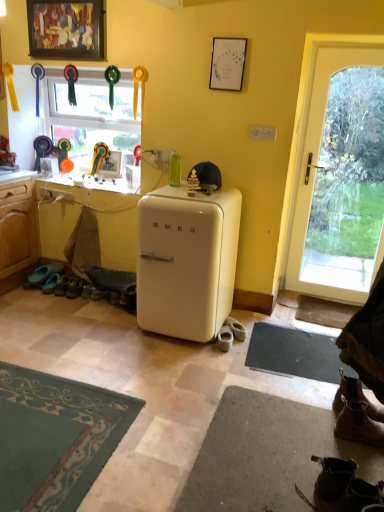
Measure the distance between point (228,348) and camera.

Point (228,348) is 9.09 feet away from camera.

Find the location of a particular element. This screenshot has width=384, height=512. black rubber yoga mat at lower right is located at coordinates (294, 353).

Image resolution: width=384 pixels, height=512 pixels. What do you see at coordinates (294, 353) in the screenshot?
I see `black rubber yoga mat at lower right` at bounding box center [294, 353].

In order to face brown leather boot at lower right, the 4th footwear from the left, should I rotate leftwards or rightwards?

To align with it, rotate right about 21.911°.

Find the location of a particular element. white suede shoes at lower center, marked as the 3th footwear in a left-to-right arrangement is located at coordinates (236, 329).

Considering the relative sizes of brown leather boot at lower right, the first footwear positioned from the right, and white glossy refrigerator at center in the image provided, is brown leather boot at lower right, the first footwear positioned from the right, smaller than white glossy refrigerator at center?

Indeed, brown leather boot at lower right, the first footwear positioned from the right, has a smaller size compared to white glossy refrigerator at center.

Where is `refrigerator located behind the brown leather boot at lower right, which is the fourth footwear in back-to-front order`? The height and width of the screenshot is (512, 384). refrigerator located behind the brown leather boot at lower right, which is the fourth footwear in back-to-front order is located at coordinates (186, 261).

From the image's perspective, would you say brown leather boot at lower right, the first footwear positioned from the right, is positioned over white glossy refrigerator at center?

No.

Is brown leather boot at lower right, the fifth footwear in the left-to-right sequence, located outside white glossy refrigerator at center?

Absolutely, brown leather boot at lower right, the fifth footwear in the left-to-right sequence, is external to white glossy refrigerator at center.

Does point (319, 343) come farther from viewer compared to point (46, 272)?

No, (319, 343) is in front of (46, 272).

Measure the distance from black rubber yoga mat at lower right to matte green shoe at lower left, placed as the 5th footwear when sorted from right to left.

The distance of black rubber yoga mat at lower right from matte green shoe at lower left, placed as the 5th footwear when sorted from right to left, is 1.95 meters.

Starting from the black rubber yoga mat at lower right, which footwear is the 3rd one to the left? Please provide its 2D coordinates.

[(42, 275)]

Is black rubber yoga mat at lower right not inside matte green shoe at lower left, placed as the 5th footwear when sorted from front to back?

black rubber yoga mat at lower right is positioned outside matte green shoe at lower left, placed as the 5th footwear when sorted from front to back.

Considering the sizes of objects white glossy refrigerator at center and brown leather boot at lower right, which is counted as the 5th footwear, starting from the back, in the image provided, who is wider, white glossy refrigerator at center or brown leather boot at lower right, which is counted as the 5th footwear, starting from the back,?

Wider between the two is white glossy refrigerator at center.

Is white glossy refrigerator at center looking in the opposite direction of brown leather boot at lower right, marked as the 1th footwear in a front-to-back arrangement?

white glossy refrigerator at center does not have its back to brown leather boot at lower right, marked as the 1th footwear in a front-to-back arrangement.

Which is more to the right, white glossy refrigerator at center or brown leather boot at lower right, which is counted as the second footwear, starting from the right?

Positioned to the right is brown leather boot at lower right, which is counted as the second footwear, starting from the right.

Is white glossy refrigerator at center not within brown leather boot at lower right, which is counted as the second footwear, starting from the right?

Yes, white glossy refrigerator at center is outside of brown leather boot at lower right, which is counted as the second footwear, starting from the right.

Relative to matte green shoe at lower left, the 1th footwear positioned from the back, is white glossy refrigerator at center in front or behind?

white glossy refrigerator at center is positioned closer to the viewer than matte green shoe at lower left, the 1th footwear positioned from the back.

Where is `the 3rd footwear behind the white glossy refrigerator at center, counting from the anchor's position`? The height and width of the screenshot is (512, 384). the 3rd footwear behind the white glossy refrigerator at center, counting from the anchor's position is located at coordinates (42, 275).

Could you tell me if white glossy refrigerator at center is facing matte green shoe at lower left, the 1th footwear positioned from the back?

No, white glossy refrigerator at center is not facing towards matte green shoe at lower left, the 1th footwear positioned from the back.

From the image's perspective, does white glossy refrigerator at center appear higher than matte green shoe at lower left, the 1th footwear positioned from the back?

Indeed, from the image's perspective, white glossy refrigerator at center is shown above matte green shoe at lower left, the 1th footwear positioned from the back.

Can you tell me how much brown leather boot at lower right, which is counted as the second footwear, starting from the right, and brown leather boot at lower right, the first footwear positioned from the right, differ in facing direction?

The angle between the facing direction of brown leather boot at lower right, which is counted as the second footwear, starting from the right, and the facing direction of brown leather boot at lower right, the first footwear positioned from the right, is 0.00273 degrees.

Locate an element on the screen. the 1st footwear behind the brown leather boot at lower right, the 4th footwear from the left is located at coordinates (355, 397).

Is brown leather boot at lower right, the 4th footwear from the left, facing towards brown leather boot at lower right, the first footwear positioned from the right?

No, brown leather boot at lower right, the 4th footwear from the left, is not oriented towards brown leather boot at lower right, the first footwear positioned from the right.

How far apart are brown leather boot at lower right, marked as the 1th footwear in a front-to-back arrangement, and brown leather boot at lower right, the first footwear positioned from the right?

A: They are 2.64 inches apart.

Considering the sizes of objects black rubber yoga mat at lower right and white glossy refrigerator at center in the image provided, who is smaller, black rubber yoga mat at lower right or white glossy refrigerator at center?

With smaller size is black rubber yoga mat at lower right.

From the image's perspective, is black rubber yoga mat at lower right over white glossy refrigerator at center?

No, from the image's perspective, black rubber yoga mat at lower right is not over white glossy refrigerator at center.

Which is more to the right, black rubber yoga mat at lower right or white glossy refrigerator at center?

black rubber yoga mat at lower right.

Between black rubber yoga mat at lower right and white glossy refrigerator at center, which one has smaller width?

With smaller width is black rubber yoga mat at lower right.

Is white leather shoe at lower center, the 3th footwear when ordered from front to back, a part of white glossy refrigerator at center?

Actually, white leather shoe at lower center, the 3th footwear when ordered from front to back, is outside white glossy refrigerator at center.

Which is behind, point (149, 267) or point (225, 348)?

Point (225, 348)

Does white glossy refrigerator at center turn towards white leather shoe at lower center, marked as the fourth footwear in a right-to-left arrangement?

No, white glossy refrigerator at center is not turned towards white leather shoe at lower center, marked as the fourth footwear in a right-to-left arrangement.

Considering the sizes of objects white glossy refrigerator at center and white leather shoe at lower center, the 3th footwear when ordered from front to back, in the image provided, who is wider, white glossy refrigerator at center or white leather shoe at lower center, the 3th footwear when ordered from front to back,?

Wider between the two is white glossy refrigerator at center.

The image size is (384, 512). In order to click on the 1st footwear in front when counting from the white glossy refrigerator at center in this screenshot , I will do `click(355, 397)`.

The height and width of the screenshot is (512, 384). Find the location of `yoga mat located below the matte green shoe at lower left, the 1th footwear positioned from the back (from the image's perspective)`. yoga mat located below the matte green shoe at lower left, the 1th footwear positioned from the back (from the image's perspective) is located at coordinates (294, 353).

Looking at the image, which one is located further to white glass door at right, black rubber yoga mat at lower right or clear glass window at upper left?

clear glass window at upper left.

Based on their spatial positions, is matte green shoe at lower left, the first footwear in the left-to-right sequence, or clear glass window at upper left further from black rubber yoga mat at lower right?

clear glass window at upper left is further to black rubber yoga mat at lower right.

Based on the photo, when comparing their distances from white glass door at right, does brown leather boot at lower right, positioned as the 2th footwear in front-to-back order, or brown leather boot at lower right, the 4th footwear from the left, seem further?

brown leather boot at lower right, the 4th footwear from the left.

Consider the image. Looking at the image, which one is located further to black rubber yoga mat at lower right, white glossy refrigerator at center or white suede shoes at lower center, which is the fourth footwear from front to back?

Based on the image, white glossy refrigerator at center appears to be further to black rubber yoga mat at lower right.

From the image, which object appears to be farther from white glossy refrigerator at center, white suede shoes at lower center, marked as the 3th footwear in a left-to-right arrangement, or white leather shoe at lower center, the second footwear viewed from the left?

white suede shoes at lower center, marked as the 3th footwear in a left-to-right arrangement, is positioned further to the anchor white glossy refrigerator at center.

Estimate the real-world distances between objects in this image. Which object is further from white leather shoe at lower center, marked as the fourth footwear in a right-to-left arrangement, black rubber yoga mat at lower right or white glass door at right?

white glass door at right lies further to white leather shoe at lower center, marked as the fourth footwear in a right-to-left arrangement, than the other object.

Based on their spatial positions, is clear glass window at upper left or white leather shoe at lower center, the second footwear viewed from the left, further from white suede shoes at lower center, marked as the 3th footwear in a left-to-right arrangement?

clear glass window at upper left.

When comparing their distances from white leather shoe at lower center, the second footwear viewed from the left, does white suede shoes at lower center, which is the second footwear from back to front, or clear glass window at upper left seem closer?

Based on the image, white suede shoes at lower center, which is the second footwear from back to front, appears to be nearer to white leather shoe at lower center, the second footwear viewed from the left.

At what (x,y) coordinates should I click in order to perform the action: click on footwear between clear glass window at upper left and white suede shoes at lower center, marked as the 3th footwear in a left-to-right arrangement, from top to bottom. Please return your answer as a coordinate pair (x, y). Looking at the image, I should click on (42, 275).

This screenshot has width=384, height=512. What are the coordinates of `yoga mat positioned between brown leather boot at lower right, which is counted as the second footwear, starting from the right, and white suede shoes at lower center, acting as the third footwear starting from the right, from near to far` in the screenshot? It's located at (294, 353).

I want to click on refrigerator situated between matte green shoe at lower left, the first footwear in the left-to-right sequence, and white suede shoes at lower center, marked as the 3th footwear in a left-to-right arrangement, from left to right, so (x=186, y=261).

Find the location of a particular element. yoga mat between white glossy refrigerator at center and white glass door at right from left to right is located at coordinates click(x=294, y=353).